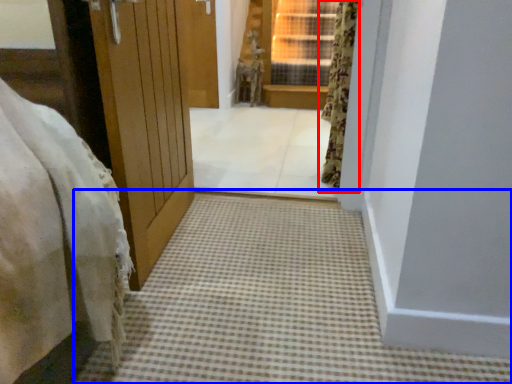
Question: Among these objects, which one is farthest to the camera, curtain (highlighted by a red box) or path (highlighted by a blue box)?

Choices:
 (A) curtain
 (B) path

Answer: (A)